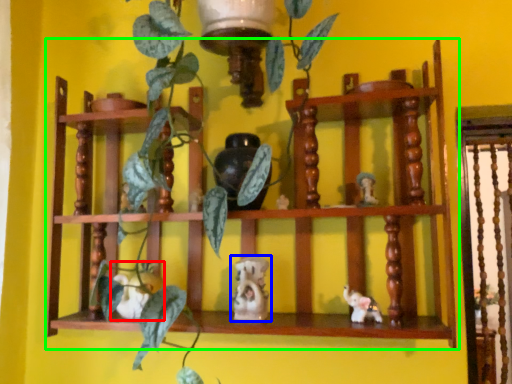
Question: Considering the real-world distances, which object is closest to toy (highlighted by a red box)? toy (highlighted by a blue box) or shelf (highlighted by a green box).

Choices:
 (A) toy
 (B) shelf

Answer: (A)